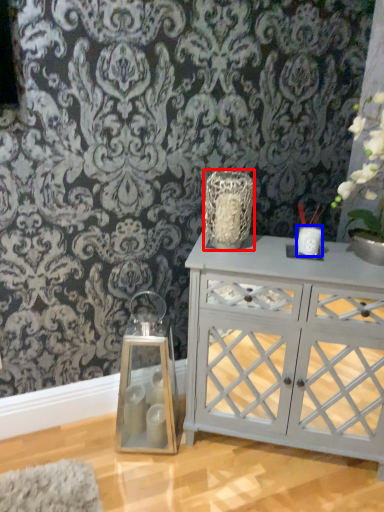
Question: Which point is closer to the camera, vase (highlighted by a red box) or candle holder (highlighted by a blue box)?

Choices:
 (A) vase
 (B) candle holder

Answer: (A)